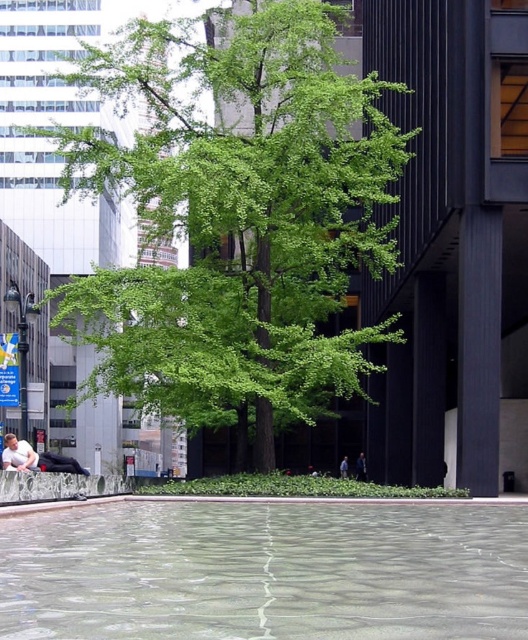
Can you confirm if green leafy tree at center is positioned to the left of clear glass water at center?

Yes, green leafy tree at center is to the left of clear glass water at center.

Does green leafy tree at center have a larger size compared to clear glass water at center?

Yes, green leafy tree at center is bigger than clear glass water at center.

Does point (267, 4) lie in front of point (290, 528)?

No, (267, 4) is behind (290, 528).

At what (x,y) coordinates should I click in order to perform the action: click on green leafy tree at center. Please return your answer as a coordinate pair (x, y). Looking at the image, I should click on (237, 218).

Which of these two, clear glass water at center or blue fabric person at center, stands taller?

clear glass water at center is taller.

The width and height of the screenshot is (528, 640). Identify the location of clear glass water at center. (266, 572).

Find the location of a particular element. This screenshot has height=640, width=528. clear glass water at center is located at coordinates (266, 572).

Does smooth concrete ledge at lower center have a greater height compared to blue fabric person at center?

Yes, smooth concrete ledge at lower center is taller than blue fabric person at center.

Who is lower down, smooth concrete ledge at lower center or blue fabric person at center?

blue fabric person at center is lower down.

Where is `smooth concrete ledge at lower center`? The width and height of the screenshot is (528, 640). smooth concrete ledge at lower center is located at coordinates (56, 486).

Where is `smooth concrete ledge at lower center`? This screenshot has width=528, height=640. smooth concrete ledge at lower center is located at coordinates (56, 486).